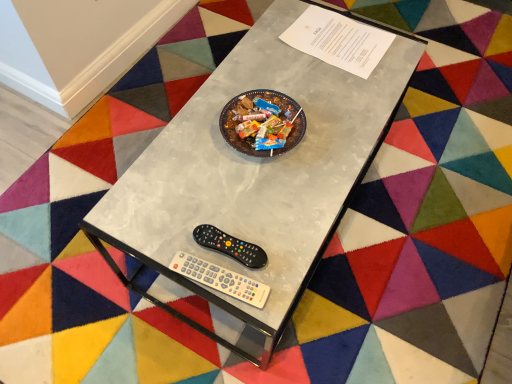
Where is `free point to the right of white plastic wii controller at lower center`? free point to the right of white plastic wii controller at lower center is located at coordinates (284, 255).